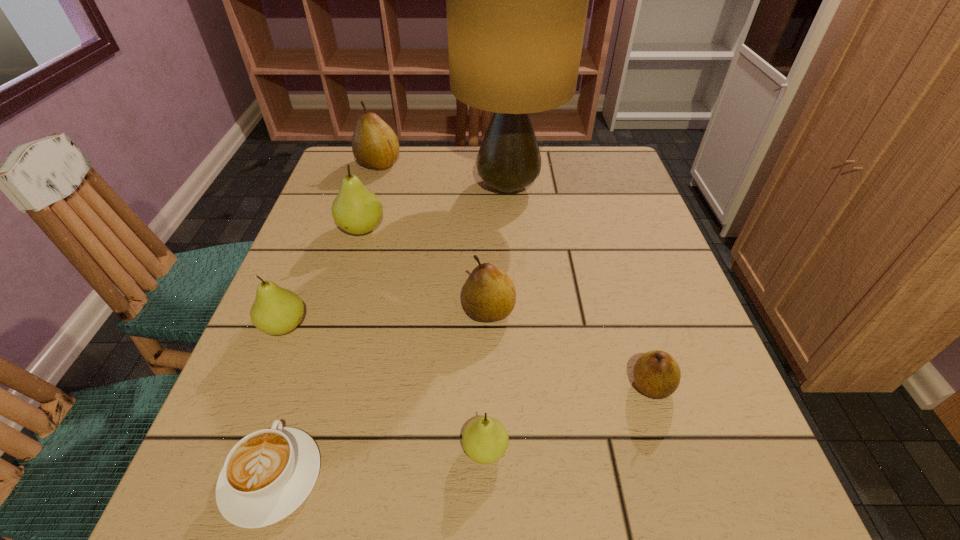
Identify the location of object that is positioned at the right edge. The height and width of the screenshot is (540, 960). (656, 373).

Where is `object at the far left corner`? This screenshot has height=540, width=960. object at the far left corner is located at coordinates (375, 145).

Where is `object present at the near left corner`? object present at the near left corner is located at coordinates (268, 474).

Identify the location of blank space at the far edge of the desktop. (479, 147).

Image resolution: width=960 pixels, height=540 pixels. In order to click on free space at the near edge in this screenshot , I will do `click(472, 505)`.

This screenshot has width=960, height=540. I want to click on vacant space at the left edge, so click(329, 195).

Find the location of a particular element. This screenshot has height=540, width=960. vacant space at the right edge of the desktop is located at coordinates (674, 412).

Identify the location of vacant space at the far right corner of the desktop. This screenshot has width=960, height=540. (602, 151).

Where is `vacant area between the tallest object and the rightmost pear`? This screenshot has width=960, height=540. vacant area between the tallest object and the rightmost pear is located at coordinates (580, 286).

The width and height of the screenshot is (960, 540). I want to click on free space between the nearest green pear and the leftmost brown pear, so click(432, 306).